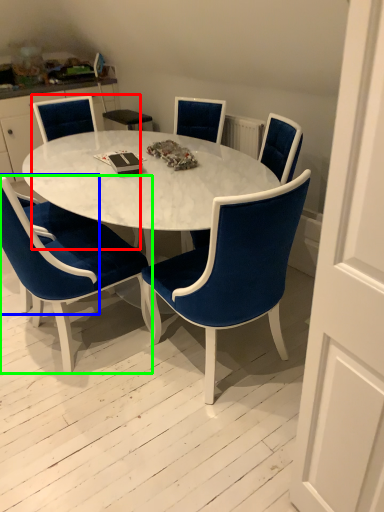
Question: Based on their relative distances, which object is nearer to chair (highlighted by a red box)? Choose from armchair (highlighted by a blue box) and chair (highlighted by a green box).

Choices:
 (A) armchair
 (B) chair

Answer: (B)